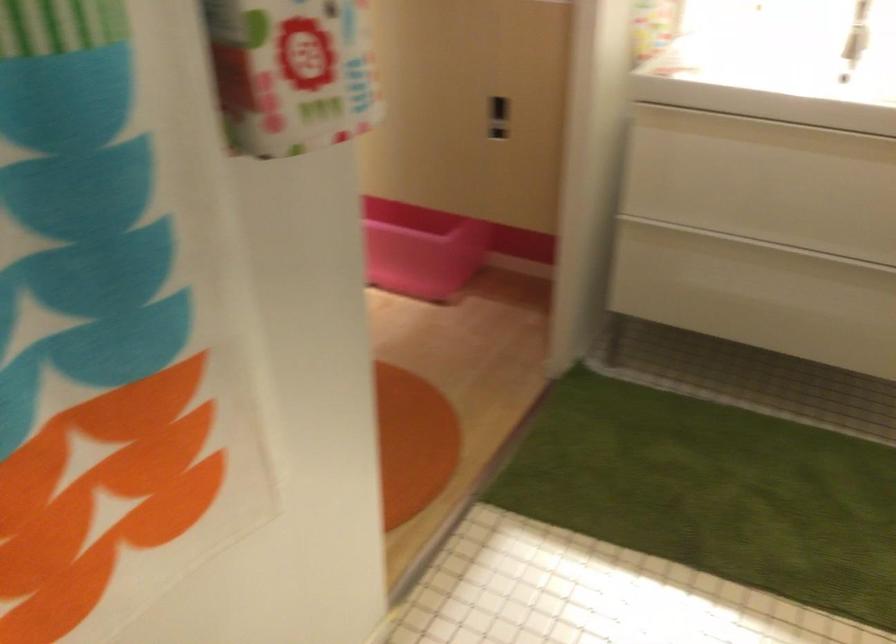
Where is `black light switch`? The width and height of the screenshot is (896, 644). black light switch is located at coordinates (497, 118).